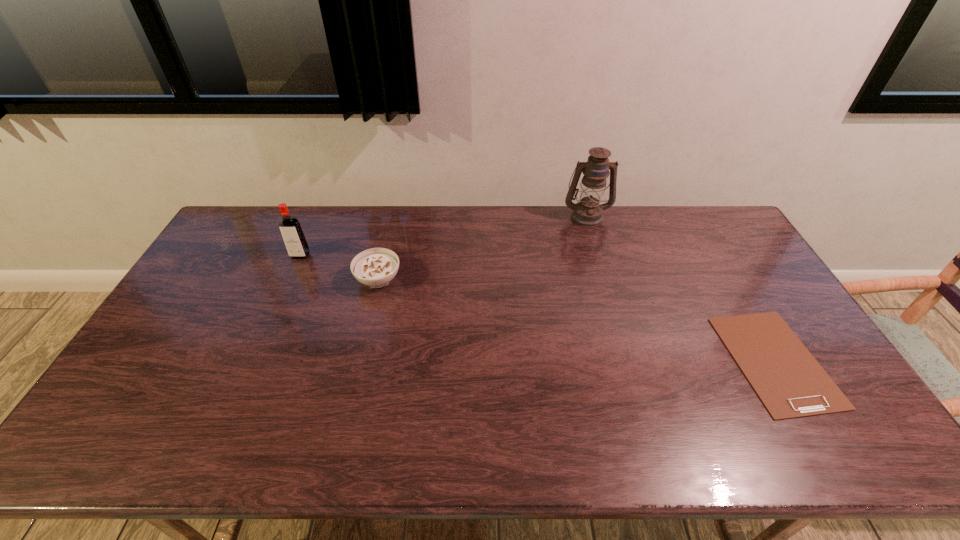
Identify the location of free space between the third tallest object and the rightmost object. click(577, 320).

This screenshot has width=960, height=540. In order to click on vacant area that lies between the tallest object and the second object from left to right in this screenshot , I will do `click(483, 248)`.

You are a GUI agent. You are given a task and a screenshot of the screen. Output one action in this format:
    pyautogui.click(x=<x>, y=<y>)
    Task: Click on the free area in between the second object from right to left and the second shortest object
    
    Given the screenshot: What is the action you would take?
    pyautogui.click(x=483, y=248)

Identify the location of vacant point located between the nearest object and the leftmost object. (538, 308).

The height and width of the screenshot is (540, 960). Identify the location of free space that is in between the third object from left to right and the second shortest object. (483, 248).

At what (x,y) coordinates should I click in order to perform the action: click on blank region between the leftmost object and the oil lamp. Please return your answer as a coordinate pair (x, y). Looking at the image, I should click on (444, 236).

Locate an element on the screen. This screenshot has width=960, height=540. blank region between the shortest object and the soup bowl is located at coordinates (577, 320).

Locate an element on the screen. The image size is (960, 540). vacant region between the oil lamp and the second tallest object is located at coordinates (444, 236).

The image size is (960, 540). I want to click on object that is the third closest to the second tallest object, so click(788, 380).

Locate an element on the screen. object that stands as the second closest to the shortest object is located at coordinates (376, 267).